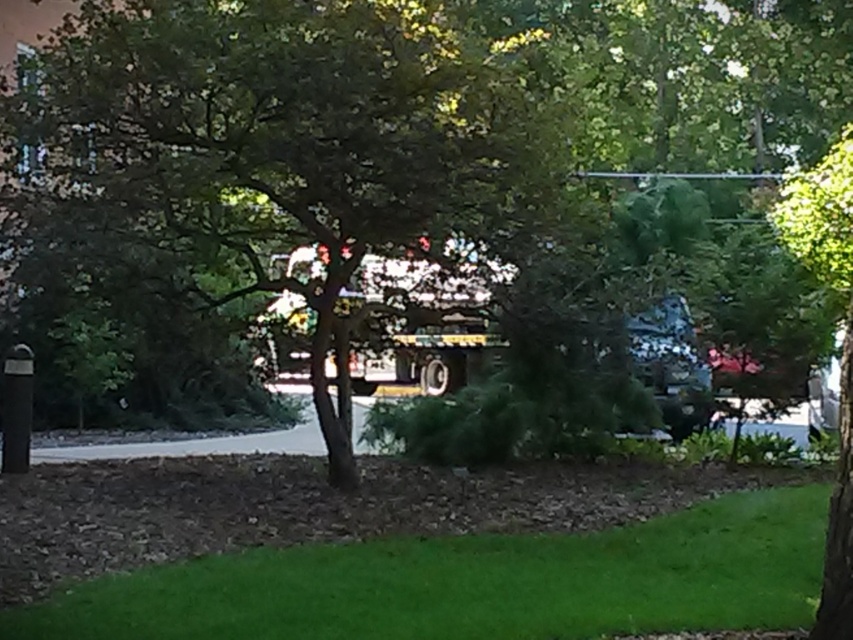
Question: Is green leafy tree at center wider than green grass at lower center?

Choices:
 (A) yes
 (B) no

Answer: (B)

Question: Can you confirm if green leafy tree at center is positioned above green grass at lower center?

Choices:
 (A) yes
 (B) no

Answer: (A)

Question: Is green leafy tree at center further to the viewer compared to green grass at lower center?

Choices:
 (A) no
 (B) yes

Answer: (B)

Question: Which of the following is the closest to the observer?

Choices:
 (A) (518, 234)
 (B) (730, 499)

Answer: (A)